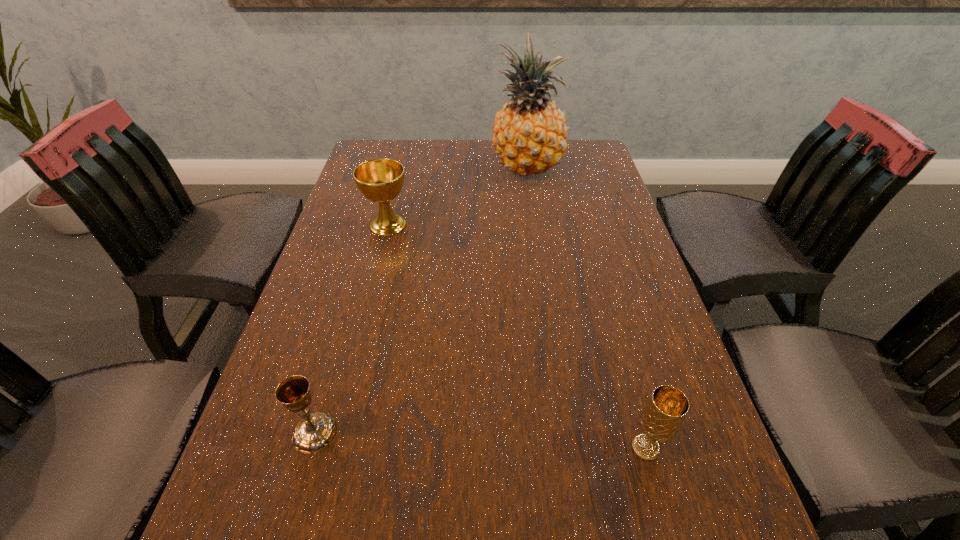
Locate which chalice is the second closest to the rightmost chalice. Please provide its 2D coordinates. Your answer should be formatted as a tuple, i.e. [(x, y)], where the tuple contains the x and y coordinates of a point satisfying the conditions above.

[(380, 180)]

Locate an element on the screen. chalice that stands as the second closest to the second farthest object is located at coordinates (665, 411).